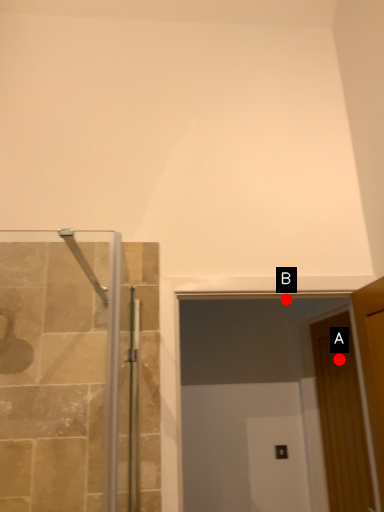
Question: Two points are circled on the image, labeled by A and B beside each circle. Which point appears farthest from the camera in this image?

Choices:
 (A) A is further
 (B) B is further

Answer: (A)